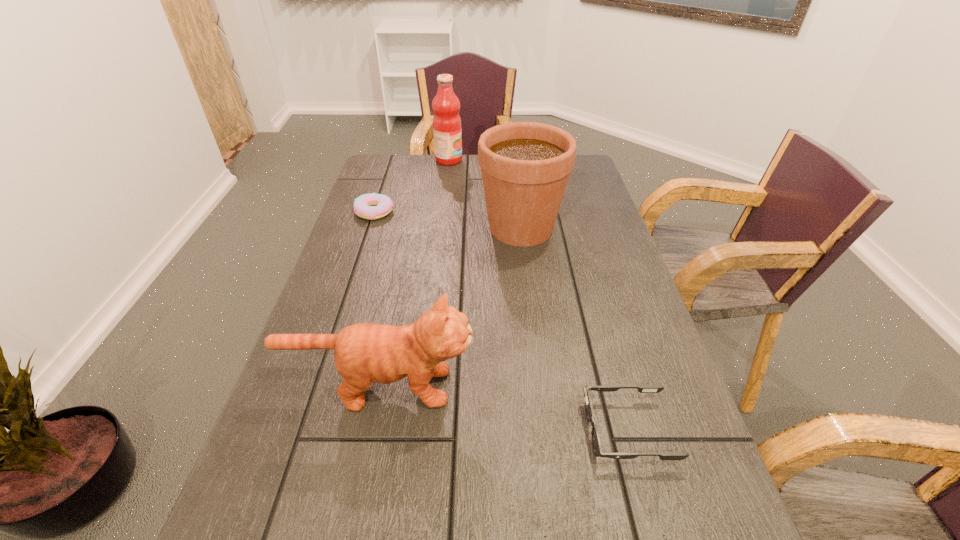
I want to click on the farthest object, so click(447, 131).

The image size is (960, 540). In order to click on flowerpot in this screenshot , I will do `click(525, 166)`.

Find the location of a particular element. The width and height of the screenshot is (960, 540). the third tallest object is located at coordinates (364, 352).

Image resolution: width=960 pixels, height=540 pixels. Identify the location of doughnut. (370, 206).

The image size is (960, 540). What are the coordinates of `sunglasses` in the screenshot? It's located at (596, 443).

Locate an element on the screen. free space located 0.200m on the front label of the fruit juice is located at coordinates (518, 160).

At what (x,y) coordinates should I click in order to perform the action: click on free space located on the front of the flowerpot. Please return your answer as a coordinate pair (x, y). The image size is (960, 540). Looking at the image, I should click on point(531,308).

This screenshot has height=540, width=960. I want to click on vacant area situated 0.250m on the face of the third tallest object, so click(603, 387).

This screenshot has height=540, width=960. In order to click on vacant space situated 0.300m on the right of the doughnut in this screenshot , I will do `click(494, 212)`.

Find the location of a particular element. This screenshot has height=540, width=960. vacant area situated 0.370m on the temples of the sunglasses is located at coordinates (378, 430).